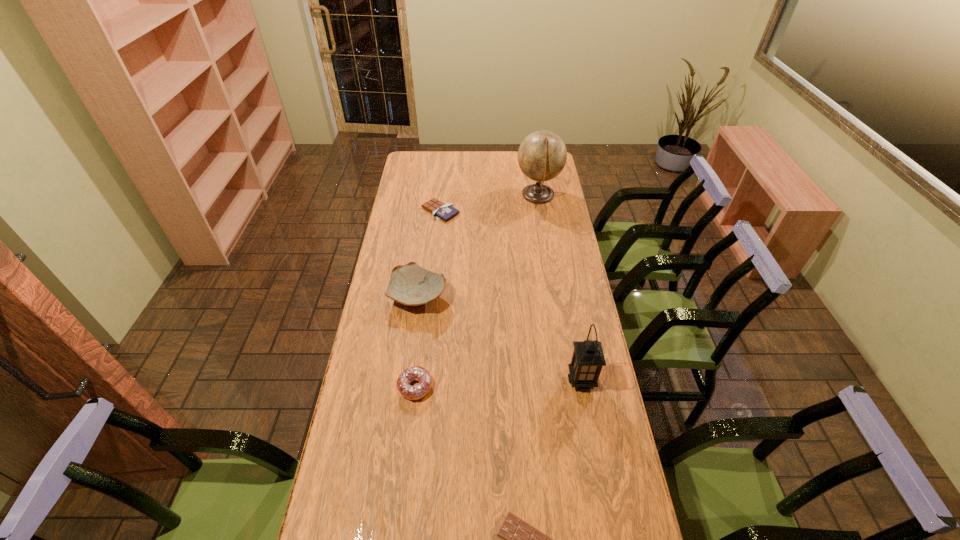
Where is `vacant space located 0.060m on the front of the second tallest object`? vacant space located 0.060m on the front of the second tallest object is located at coordinates (588, 410).

Where is `vacant region located on the front of the fourth nearest object`? The image size is (960, 540). vacant region located on the front of the fourth nearest object is located at coordinates (412, 349).

Where is `vacant point located 0.070m on the back of the third shortest object`? This screenshot has width=960, height=540. vacant point located 0.070m on the back of the third shortest object is located at coordinates (419, 354).

The image size is (960, 540). In order to click on blank space located 0.230m on the right of the second shortest object in this screenshot , I will do `click(508, 211)`.

Locate an element on the screen. The image size is (960, 540). pottery located in the left edge section of the desktop is located at coordinates (412, 285).

Where is `doughnut that is at the left edge`? Image resolution: width=960 pixels, height=540 pixels. doughnut that is at the left edge is located at coordinates (418, 373).

Find the location of a particular element. Image resolution: width=960 pixels, height=540 pixels. chocolate bar at the left edge is located at coordinates (440, 210).

Identify the location of globe that is at the right edge. The height and width of the screenshot is (540, 960). (542, 155).

What are the coordinates of `lantern that is at the right edge` in the screenshot? It's located at (588, 358).

At what (x,y) coordinates should I click in order to perform the action: click on vacant space at the far edge of the desktop. Please return your answer as a coordinate pair (x, y). The height and width of the screenshot is (540, 960). Looking at the image, I should click on (490, 160).